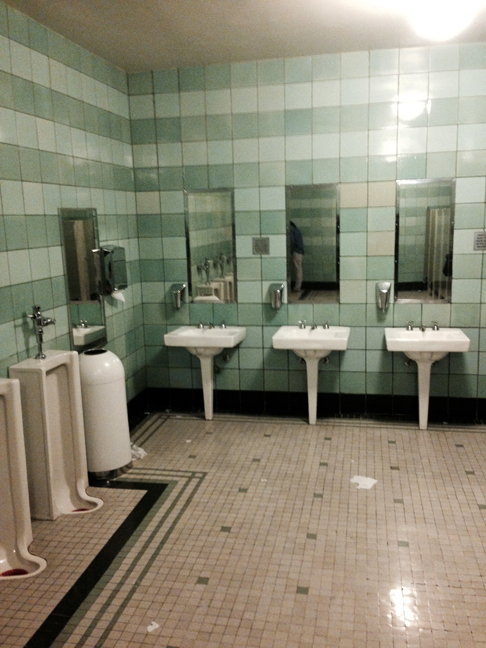
The height and width of the screenshot is (648, 486). Identify the location of sink. (200, 339), (303, 343), (421, 343).